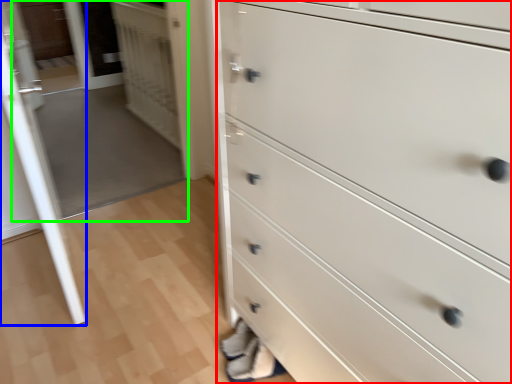
Question: Estimate the real-world distances between objects in this image. Which object is farther from chest of drawers (highlighted by a red box), glass door (highlighted by a blue box) or glass door (highlighted by a green box)?

Choices:
 (A) glass door
 (B) glass door

Answer: (B)